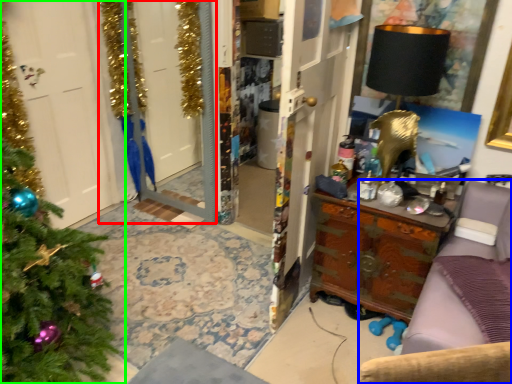
Question: Which object is positioned farthest from screen door (highlighted by a red box)? Select from furniture (highlighted by a blue box) and christmas tree (highlighted by a green box).

Choices:
 (A) furniture
 (B) christmas tree

Answer: (A)